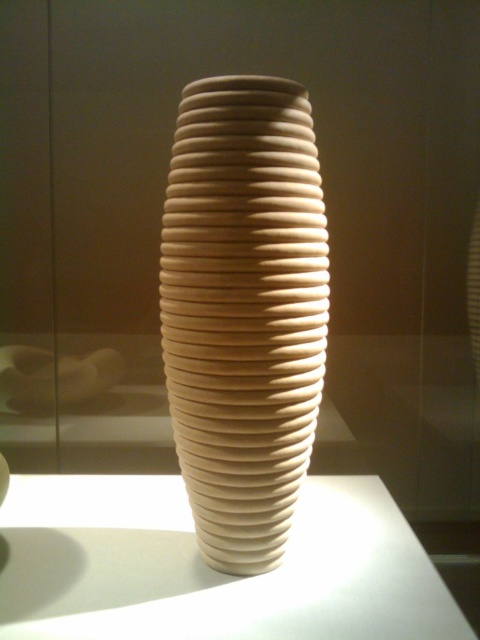
Question: Which point appears farthest from the camera in this image?

Choices:
 (A) (292, 204)
 (B) (197, 605)

Answer: (B)

Question: Does matte beige vase at center have a smaller size compared to white matte table at center?

Choices:
 (A) no
 (B) yes

Answer: (B)

Question: Which point is closer to the camera?

Choices:
 (A) white matte table at center
 (B) matte beige vase at center

Answer: (A)

Question: Is the position of matte beige vase at center more distant than that of white matte table at center?

Choices:
 (A) yes
 (B) no

Answer: (A)

Question: Does matte beige vase at center have a smaller size compared to white matte table at center?

Choices:
 (A) no
 (B) yes

Answer: (B)